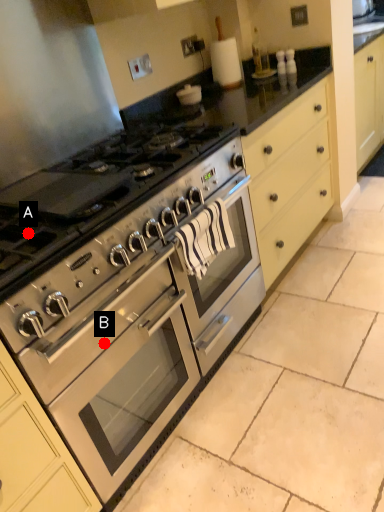
Question: Two points are circled on the image, labeled by A and B beside each circle. Which of the following is the closest to the observer?

Choices:
 (A) A is closer
 (B) B is closer

Answer: (A)